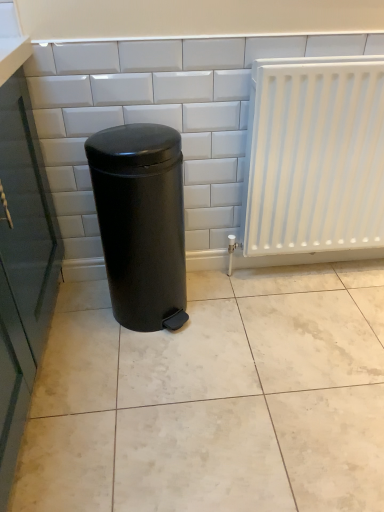
Question: Considering the positions of white matte radiator at right and white glossy tile at center in the image, is white matte radiator at right taller or shorter than white glossy tile at center?

Choices:
 (A) tall
 (B) short

Answer: (B)

Question: From a real-world perspective, relative to white glossy tile at center, is white matte radiator at right vertically above or below?

Choices:
 (A) below
 (B) above

Answer: (A)

Question: Estimate the real-world distances between objects in this image. Which object is closer to the white matte radiator at right?

Choices:
 (A) white glossy tile at center
 (B) black matte waste container at center

Answer: (A)

Question: Estimate the real-world distances between objects in this image. Which object is closer to the black matte waste container at center?

Choices:
 (A) white matte radiator at right
 (B) white glossy tile at center

Answer: (B)